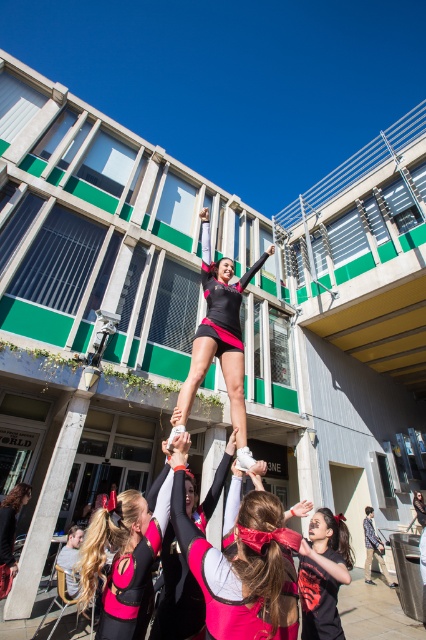
You are a photographer trying to capture the cheerleading stunt. You want to ensure both the matte pink cheerleader at center and the matte black leotard at center are visible in your shot. Based on their positions, which one should you focus on first to frame them properly?

The matte pink cheerleader at center is to the left of the matte black leotard at center, so you should focus on the matte pink cheerleader at center first to ensure both are framed properly in the shot.

You are a photographer standing at the base of the modern building and want to capture a closeup shot of the matte pink uniform at center. Considering your current position, can you estimate how far you need to move forward to get a clear closeup without moving the subjects?

The matte pink uniform at center is 2.00 meters away from viewer. To get a clear closeup, you need to move forward approximately 2.00 meters towards the matte pink uniform at center.